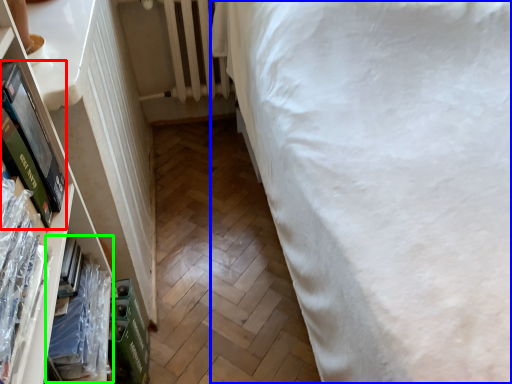
Question: Estimate the real-world distances between objects in this image. Which object is closer to paperback book (highlighted by a red box), bed (highlighted by a blue box) or book (highlighted by a green box)?

Choices:
 (A) bed
 (B) book

Answer: (B)